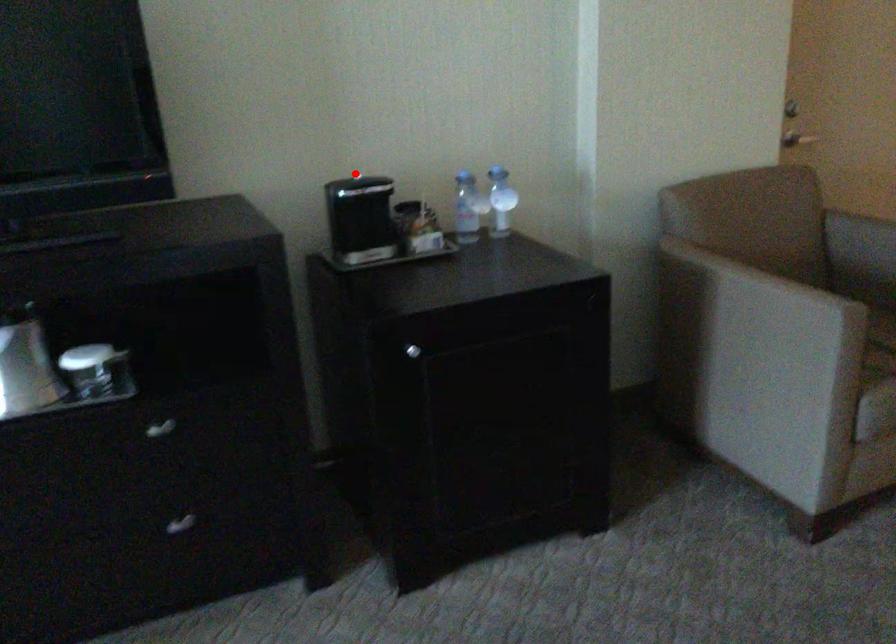
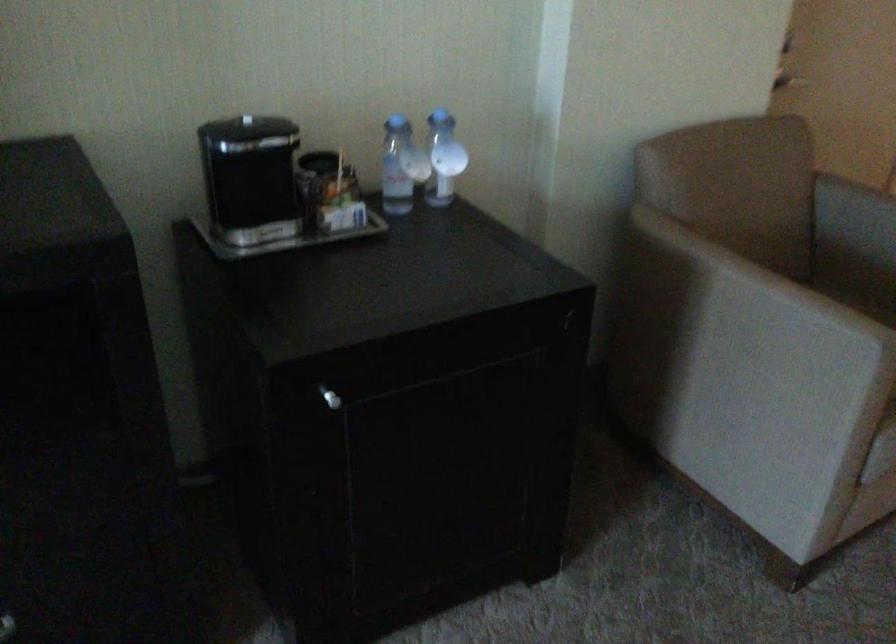
Question: I am providing you with two images of the same scene from different viewpoints. Given a red point in image1, look at the same physical point in image2. Is it:

Choices:
 (A) Closer to the viewpoint
 (B) Farther from the viewpoint

Answer: (A)